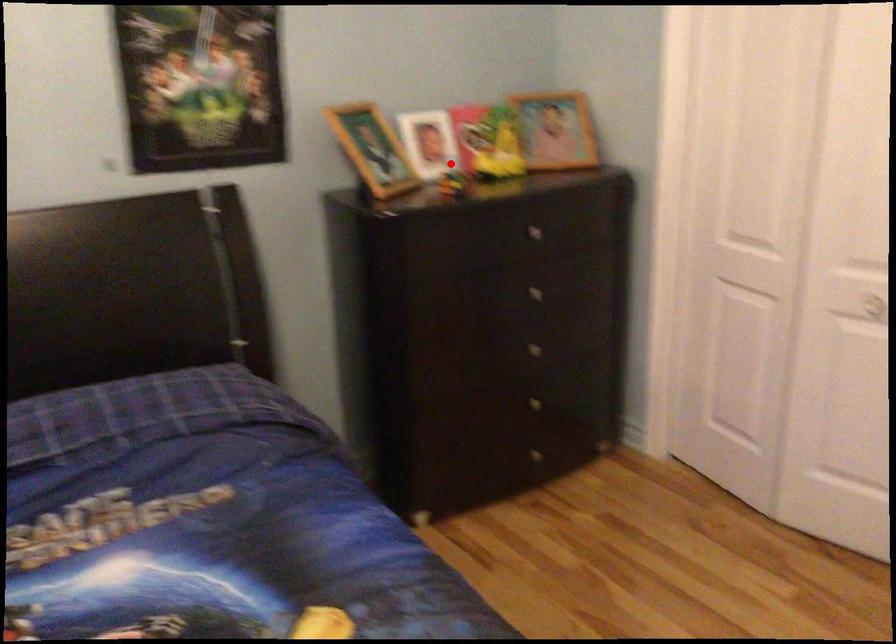
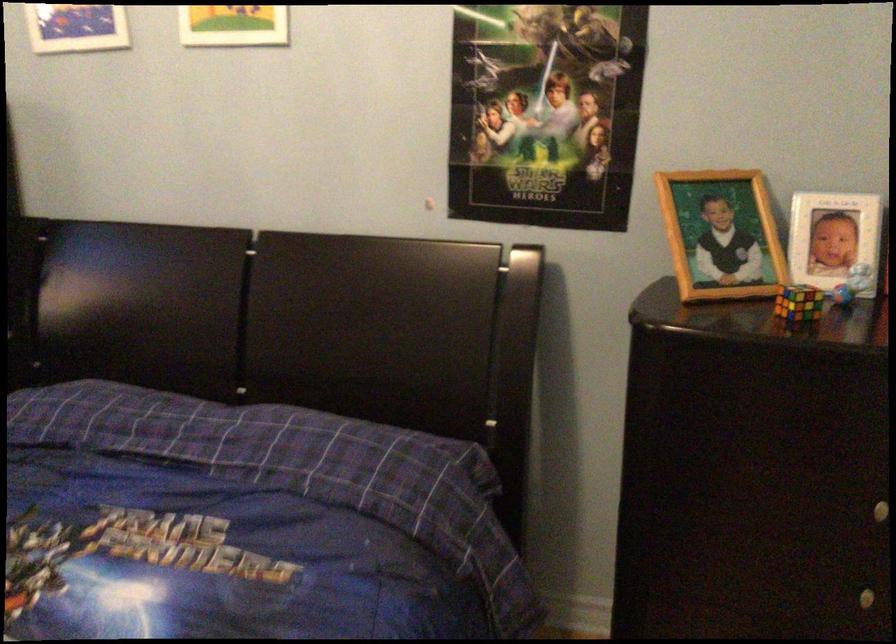
Find the pixel in the second image that matches the highlighted location in the first image.

(851, 283)